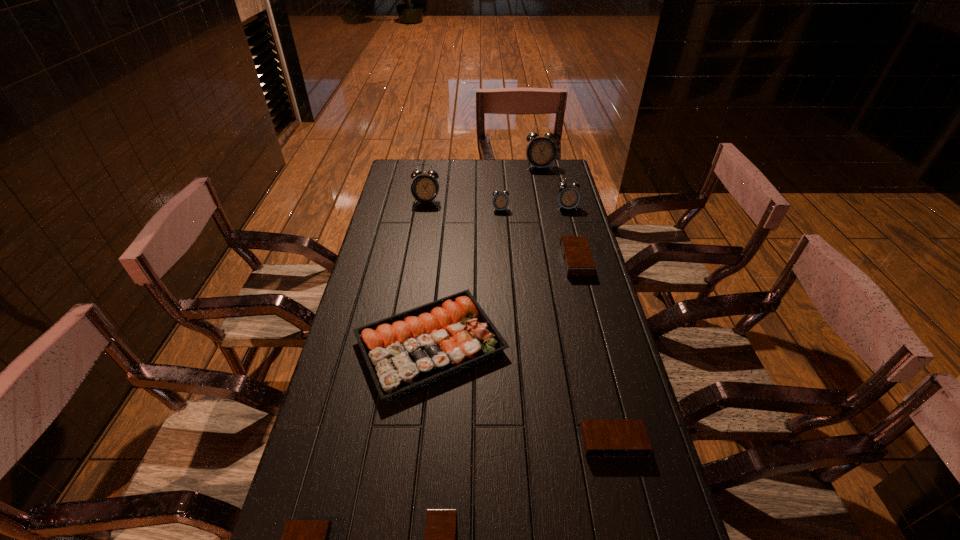
Locate an element on the screen. This screenshot has width=960, height=540. the farthest black alarm clock is located at coordinates (578, 262).

This screenshot has height=540, width=960. Identify the location of the seventh tallest object. (601, 437).

Image resolution: width=960 pixels, height=540 pixels. Find the location of `the third smallest black alarm clock`. the third smallest black alarm clock is located at coordinates [x=601, y=437].

Find the location of a particular element. vacant region located on the face of the farthest white alarm clock is located at coordinates (547, 208).

You are a GUI agent. You are given a task and a screenshot of the screen. Output one action in this format:
    pyautogui.click(x=<x>, y=<y>)
    Task: Click on the vacant region located 0.250m on the face of the second tallest object
    The image size is (960, 540).
    Given the screenshot: What is the action you would take?
    pyautogui.click(x=420, y=245)

Identify the location of free space located on the face of the second smallest white alarm clock. (576, 241).

The image size is (960, 540). Identify the location of blank space located on the face of the sixth shortest object. (502, 231).

In order to click on vacant area located 0.150m on the back of the fourth nearest object in this screenshot , I will do [x=439, y=266].

The height and width of the screenshot is (540, 960). I want to click on vacant space located on the front face of the fifth tallest alarm clock, so click(543, 261).

Find the location of a particular element. vacant space located on the front face of the fifth tallest alarm clock is located at coordinates click(x=455, y=261).